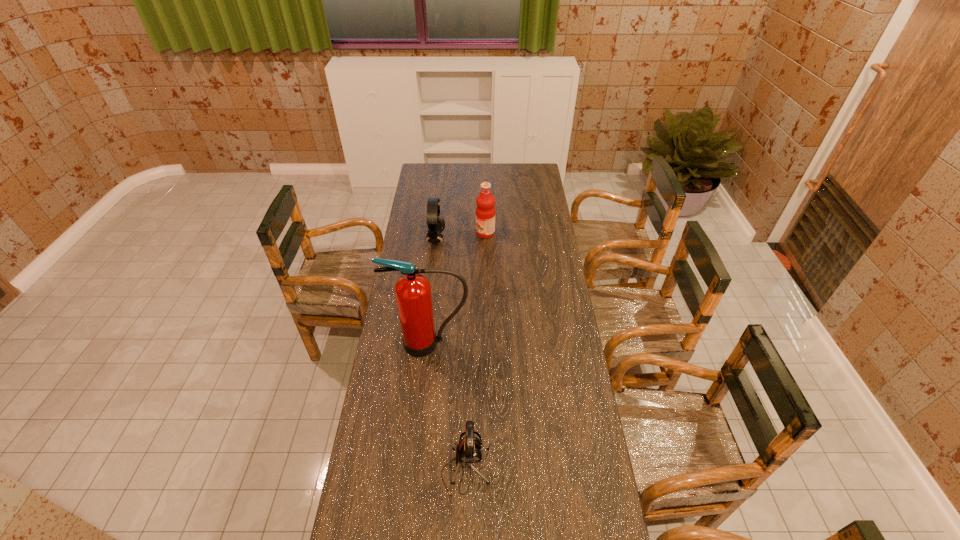
You are a GUI agent. You are given a task and a screenshot of the screen. Output one action in this format:
    pyautogui.click(x=<x>, y=<y>)
    Task: Click on the fire extinguisher
    Image resolution: width=960 pixels, height=540 pixels.
    Given the screenshot: What is the action you would take?
    pos(413,294)

This screenshot has height=540, width=960. Find the location of `the second nearest object`. the second nearest object is located at coordinates (413, 294).

Locate an element on the screen. This screenshot has height=540, width=960. the third shortest object is located at coordinates (485, 211).

Locate an element on the screen. The width and height of the screenshot is (960, 540). the left earphone is located at coordinates (436, 224).

I want to click on the right earphone, so click(468, 451).

The width and height of the screenshot is (960, 540). What are the coordinates of `the nearest object` in the screenshot? It's located at (468, 451).

Where is `vacant region located on the front of the fire extinguisher`? vacant region located on the front of the fire extinguisher is located at coordinates (426, 379).

This screenshot has height=540, width=960. Identify the location of vacant space located 0.130m on the front label of the fruit juice. (451, 233).

The image size is (960, 540). I want to click on free space located 0.080m on the front label of the fruit juice, so click(461, 233).

The height and width of the screenshot is (540, 960). Find the location of `vacant space located on the front label of the fruit juice`. vacant space located on the front label of the fruit juice is located at coordinates (430, 233).